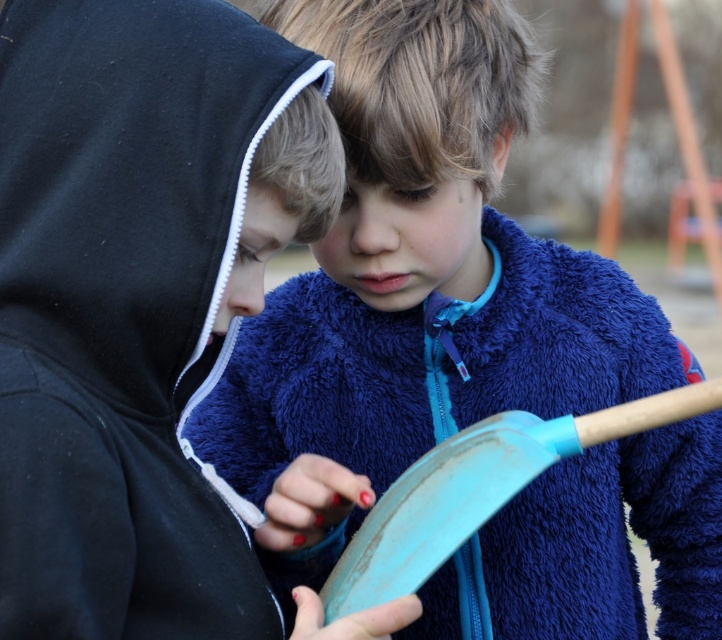
Question: Which point is closer to the camera?

Choices:
 (A) teal plastic shovel at center
 (B) blue fuzzy sweater at center

Answer: (A)

Question: Is blue fuzzy sweater at center above teal plastic shovel at center?

Choices:
 (A) yes
 (B) no

Answer: (A)

Question: Does blue fuzzy sweater at center appear under teal plastic shovel at center?

Choices:
 (A) yes
 (B) no

Answer: (B)

Question: Which point is closer to the camera taking this photo?

Choices:
 (A) (430, 570)
 (B) (290, 365)

Answer: (A)

Question: Which object appears farthest from the camera in this image?

Choices:
 (A) blue fuzzy sweater at center
 (B) teal plastic shovel at center

Answer: (A)

Question: Can you confirm if blue fuzzy sweater at center is positioned above teal plastic shovel at center?

Choices:
 (A) no
 (B) yes

Answer: (B)